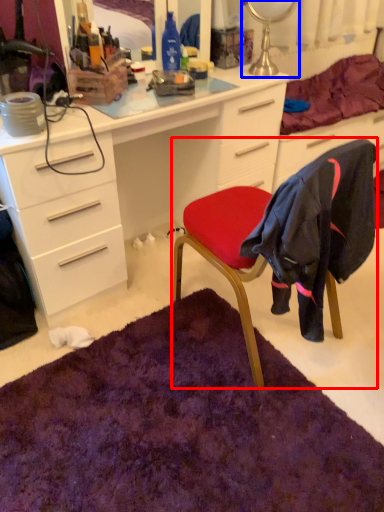
Question: Which of the following is the closest to the observer, chair (highlighted by a red box) or table lamp (highlighted by a blue box)?

Choices:
 (A) chair
 (B) table lamp

Answer: (A)